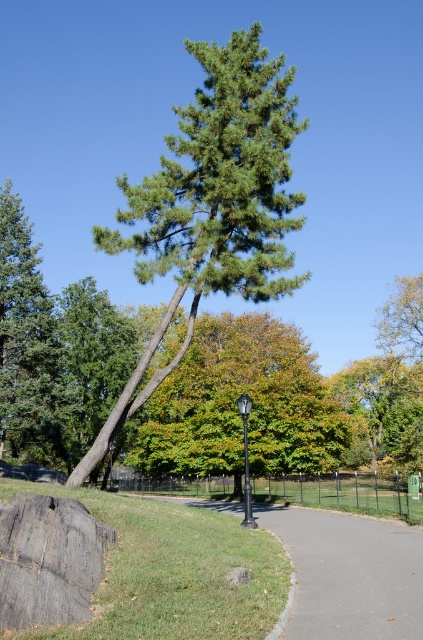
Based on the photo, you are a photographer standing at the camera position. You want to take a photo of the green leafy tree at center. The camera has a maximum focus range of 25 meters. Will the tree be in focus?

The green leafy tree at center is 27.49 meters from camera, which exceeds the camera maximum focus range of 25 meters. So the tree will not be in focus.